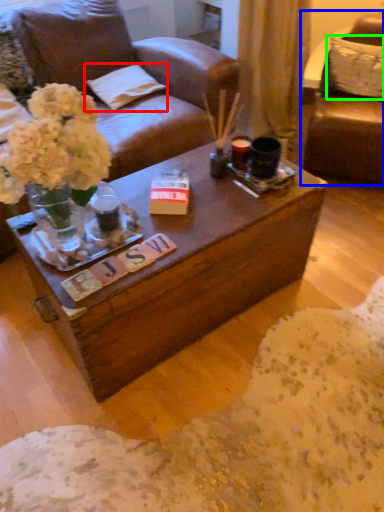
Question: Which is nearer to the pillow (highlighted by a red box)? chair (highlighted by a blue box) or pillow (highlighted by a green box).

Choices:
 (A) chair
 (B) pillow

Answer: (A)